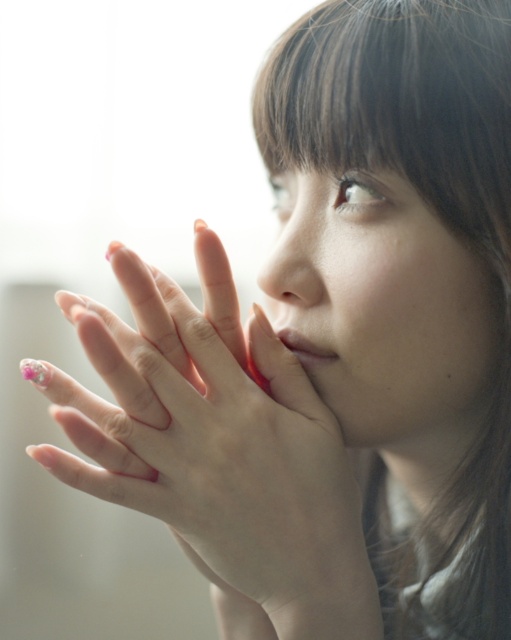
Question: Which object is closer to the camera taking this photo?

Choices:
 (A) matte pink lipstick at center
 (B) pink nail polish at center

Answer: (B)

Question: Estimate the real-world distances between objects in this image. Which object is closer to the matte pink lipstick at center?

Choices:
 (A) smooth skin face at center
 (B) pink nail polish at center

Answer: (A)

Question: Estimate the real-world distances between objects in this image. Which object is closer to the matte pink lipstick at center?

Choices:
 (A) pink nail polish at center
 (B) smooth skin face at center

Answer: (B)

Question: Is smooth skin face at center thinner than matte pink lipstick at center?

Choices:
 (A) no
 (B) yes

Answer: (A)

Question: Can you confirm if smooth skin face at center is positioned to the right of matte pink lipstick at center?

Choices:
 (A) yes
 (B) no

Answer: (A)

Question: Is smooth skin face at center positioned at the back of matte pink lipstick at center?

Choices:
 (A) no
 (B) yes

Answer: (A)